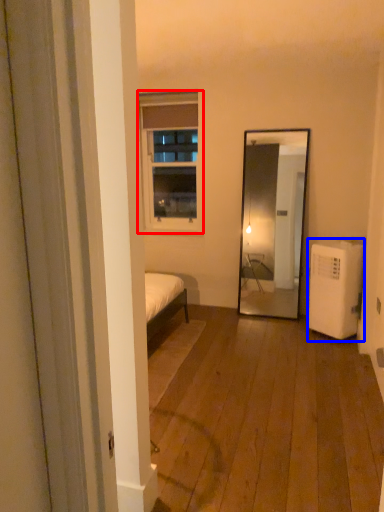
Question: Which point is closer to the camera, window (highlighted by a red box) or air conditioner (highlighted by a blue box)?

Choices:
 (A) window
 (B) air conditioner

Answer: (B)